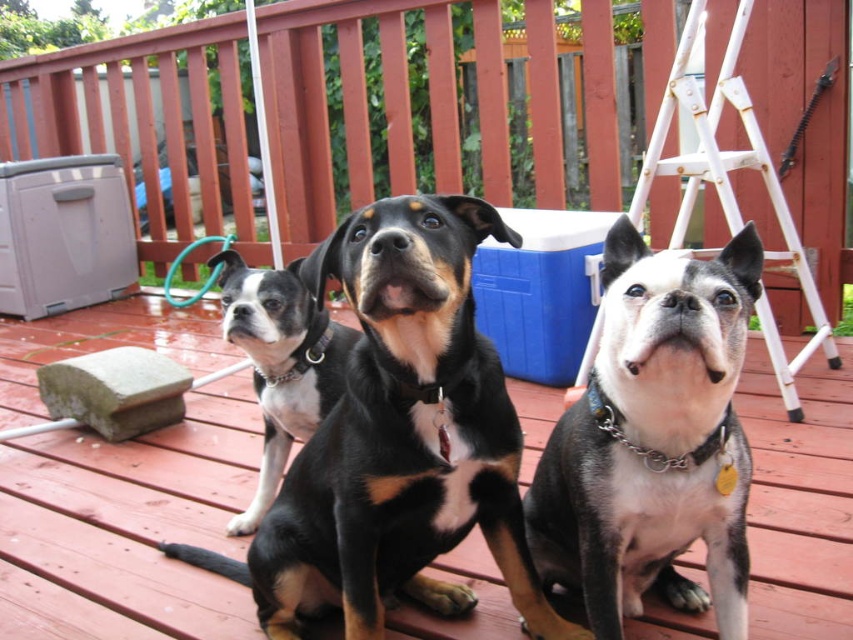
Looking at this image, you are standing on the wooden deck and want to place a gray plastic cooler at left. Where exactly should you put it according to the coordinates provided?

The gray plastic cooler at left should be placed at the 2D location point of coordinates (64, 234).

You are organizing a picnic and need to place the gray plastic cooler at left and the blue plastic cooler at center on the deck. Which cooler should you move first to ensure they are aligned properly?

The gray plastic cooler at left is positioned on the left side of the blue plastic cooler at center, so you should move the gray plastic cooler at left first to align them properly.